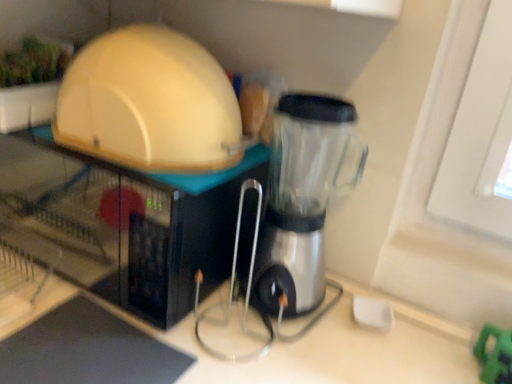
You are a GUI agent. You are given a task and a screenshot of the screen. Output one action in this format:
    pyautogui.click(x=<x>, y=<y>)
    Task: Click on the free spot above transparent plastic blender at center (from a real-world perspective)
    The image size is (512, 384).
    Given the screenshot: What is the action you would take?
    318,104